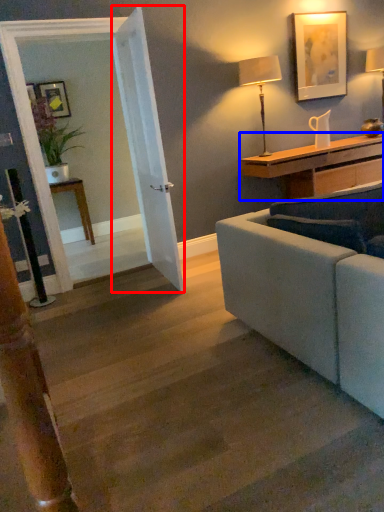
Question: Which point is closer to the camera, door (highlighted by a red box) or desk (highlighted by a blue box)?

Choices:
 (A) door
 (B) desk

Answer: (A)